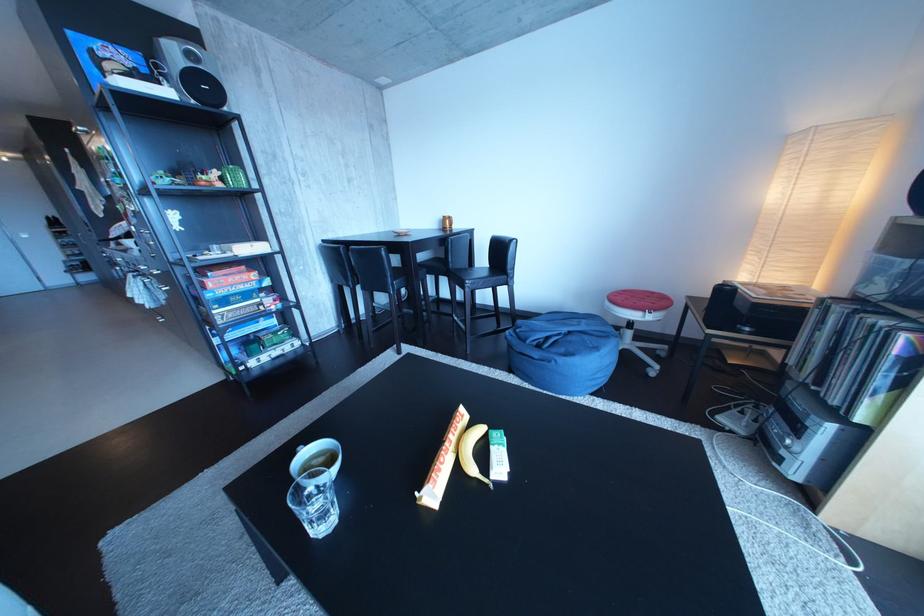
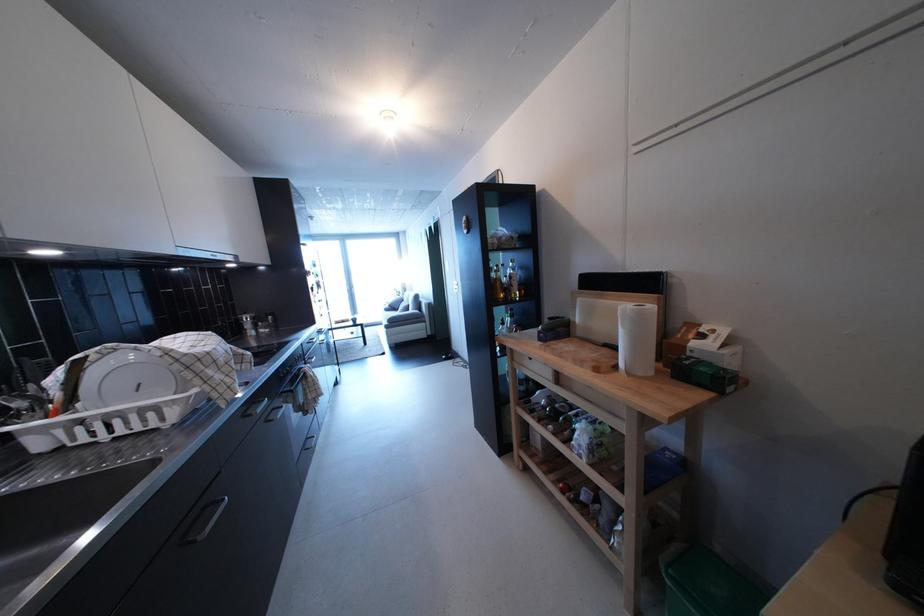
Question: I am providing you with two images of the same scene from different viewpoints. Please identify which objects are invisible in image2.

Choices:
 (A) small blue crate
 (B) small green box
 (C) vinyl record sleeve
 (D) wooden drawer handle

Answer: (C)